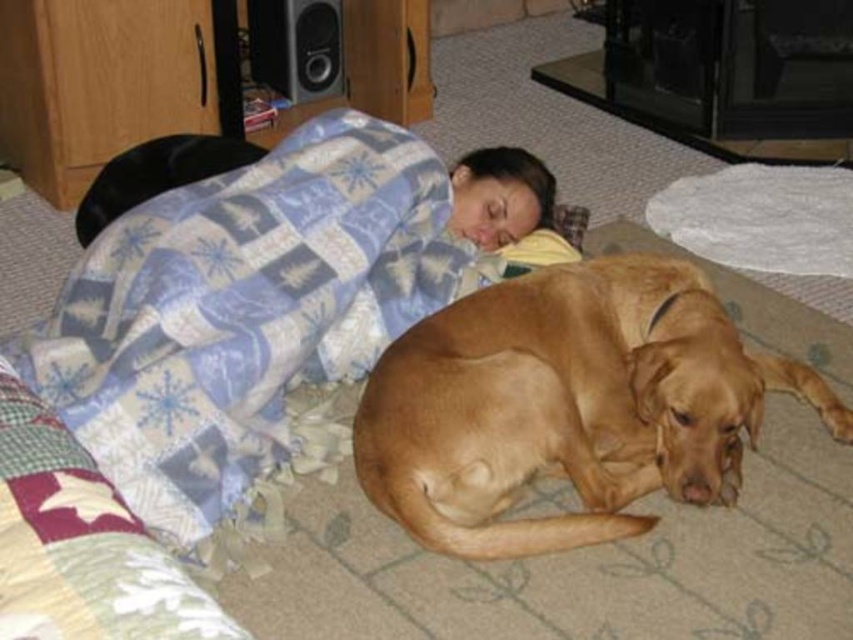
Question: Estimate the real-world distances between objects in this image. Which object is farther from the blue plaid blanket at upper center?

Choices:
 (A) metallic silver speaker at upper left
 (B) golden fur dog at lower right

Answer: (A)

Question: Based on their relative distances, which object is farther from the golden fur dog at lower right?

Choices:
 (A) blue plaid blanket at upper center
 (B) metallic silver speaker at upper left

Answer: (B)

Question: Can you confirm if blue plaid blanket at upper center is wider than golden fur dog at lower right?

Choices:
 (A) no
 (B) yes

Answer: (B)

Question: Which point is farther from the camera taking this photo?

Choices:
 (A) click(x=173, y=225)
 (B) click(x=631, y=330)
 (C) click(x=294, y=10)

Answer: (C)

Question: Is blue plaid blanket at upper center bigger than metallic silver speaker at upper left?

Choices:
 (A) no
 (B) yes

Answer: (B)

Question: Can you confirm if blue plaid blanket at upper center is positioned to the right of golden fur dog at lower right?

Choices:
 (A) yes
 (B) no

Answer: (B)